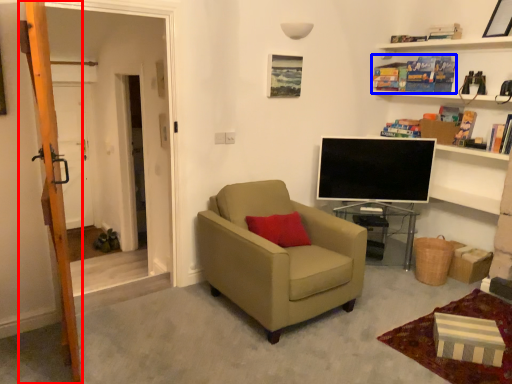
Question: Which of the following is the closest to the observer, ladder (highlighted by a red box) or book (highlighted by a blue box)?

Choices:
 (A) ladder
 (B) book

Answer: (A)